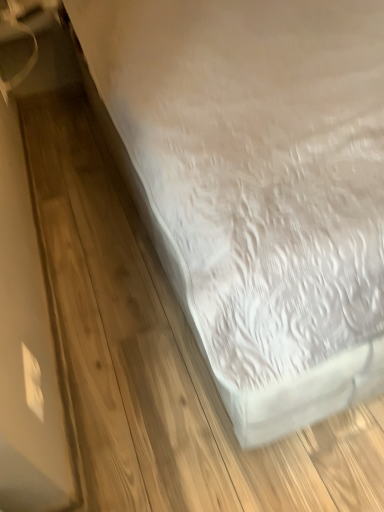
This screenshot has height=512, width=384. What do you see at coordinates (256, 186) in the screenshot? I see `white textured mattress at upper right` at bounding box center [256, 186].

Find the location of a particular element. Image resolution: width=384 pixels, height=512 pixels. white textured mattress at upper right is located at coordinates (256, 186).

The height and width of the screenshot is (512, 384). In order to click on white textured mattress at upper right in this screenshot , I will do `click(256, 186)`.